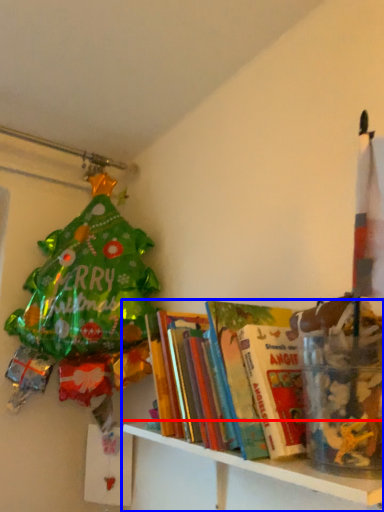
Question: Which object is closer to the camera taking this photo, shelf (highlighted by a red box) or shelf (highlighted by a blue box)?

Choices:
 (A) shelf
 (B) shelf

Answer: (A)